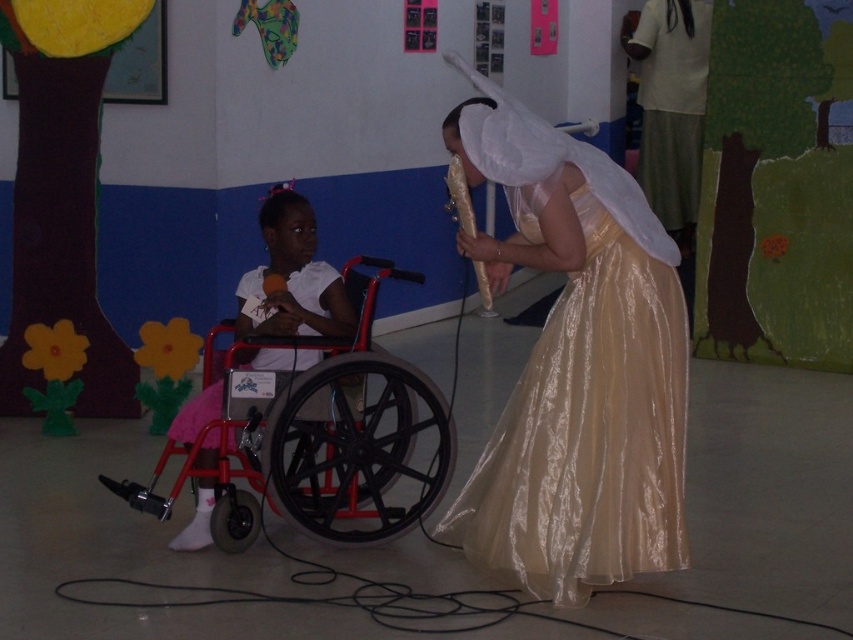
You are a photographer standing in front of the scene. You need to position yourself so that you can capture both the shiny gold dress at center and the young girl in the red wheelchair in the same frame. Based on their positions, where should you stand to ensure both are visible?

The shiny gold dress at center is located at coordinates point (585, 419). To include both the shiny gold dress at center and the young girl in the red wheelchair in the frame, position yourself centrally between them, ensuring both are within the camera view.